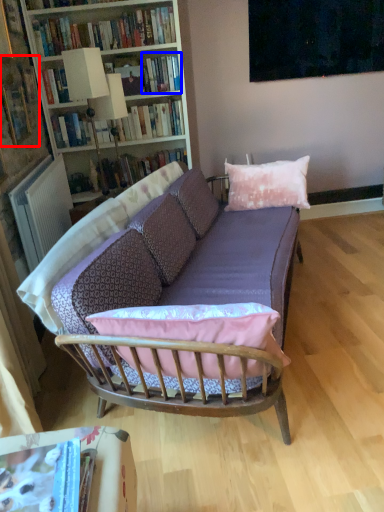
Question: Among these objects, which one is farthest to the camera, book (highlighted by a red box) or book (highlighted by a blue box)?

Choices:
 (A) book
 (B) book

Answer: (B)